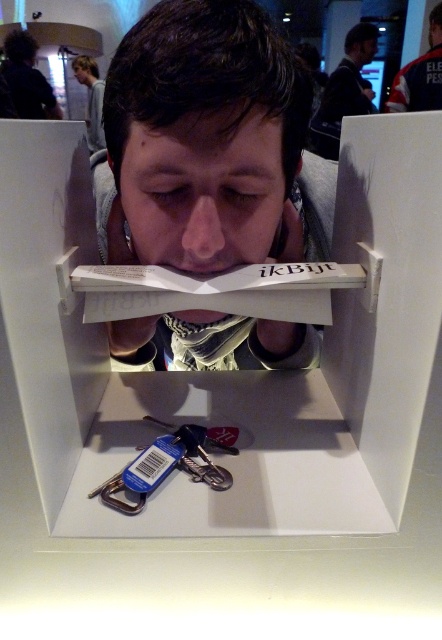
Between dark brown leather jacket at upper center and dark curly hair at upper left, which one appears on the right side from the viewer's perspective?

From the viewer's perspective, dark brown leather jacket at upper center appears more on the right side.

Who is more forward, (354, 80) or (6, 77)?

Point (6, 77) is more forward.

The width and height of the screenshot is (442, 640). Find the location of `dark brown leather jacket at upper center`. dark brown leather jacket at upper center is located at coordinates (343, 92).

Does point (411, 60) come in front of point (91, 138)?

No.

I want to click on white fabric shirt at upper center, so [420, 74].

Who is more distant from viewer, (434, 38) or (102, 125)?

Point (102, 125)

In order to click on white fabric shirt at upper center in this screenshot , I will do `click(420, 74)`.

Between metallic key at lower center and dark brown leather jacket at upper center, which one has more height?

Standing taller between the two is dark brown leather jacket at upper center.

Which is in front, point (221, 490) or point (336, 132)?

Point (221, 490) is in front.

Identify the location of metallic key at lower center. The height and width of the screenshot is (640, 442). (166, 465).